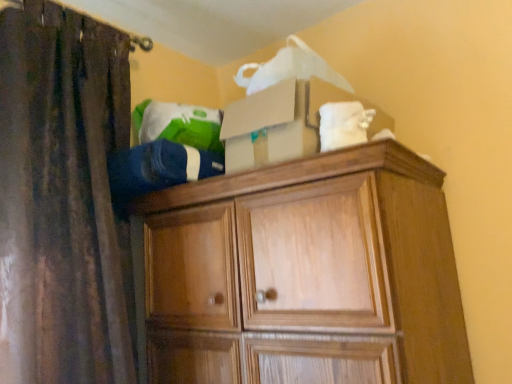
Question: In the image, is white fabric at upper right, marked as the 1th clothing in a right-to-left arrangement, positioned in front of or behind wooden cabinet at upper center?

Choices:
 (A) front
 (B) behind

Answer: (B)

Question: Considering the positions of white fabric at upper right, acting as the 2th clothing starting from the left, and wooden cabinet at upper center in the image, is white fabric at upper right, acting as the 2th clothing starting from the left, wider or thinner than wooden cabinet at upper center?

Choices:
 (A) wide
 (B) thin

Answer: (B)

Question: Which object is the farthest from the wooden cabinet at upper center?

Choices:
 (A) brown fabric curtain at left
 (B) white fabric at upper right, acting as the 2th clothing starting from the left
 (C) blue fleece jacket at upper center, the 2th clothing when ordered from right to left

Answer: (A)

Question: Which object is the farthest from the blue fleece jacket at upper center, the 2th clothing when ordered from right to left?

Choices:
 (A) wooden cabinet at upper center
 (B) white fabric at upper right, marked as the 1th clothing in a right-to-left arrangement
 (C) brown fabric curtain at left

Answer: (B)